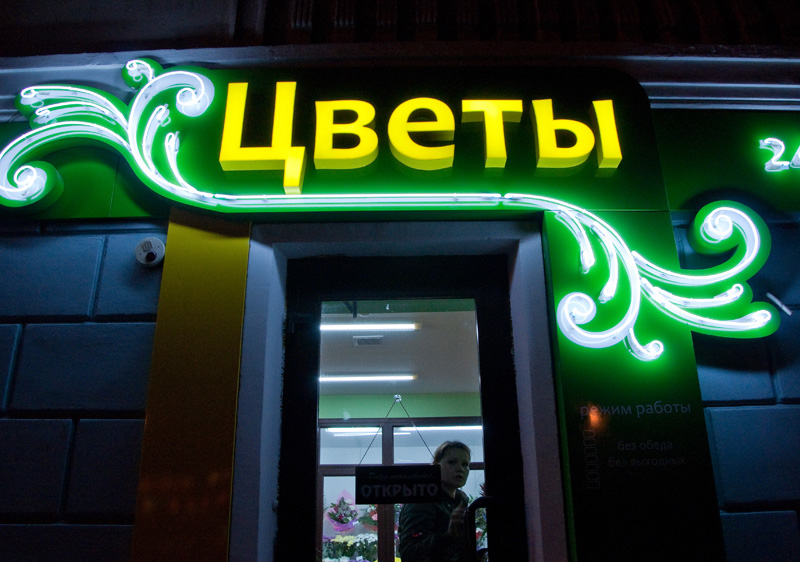
This screenshot has height=562, width=800. In order to click on sign above door in this screenshot , I will do `click(402, 147)`.